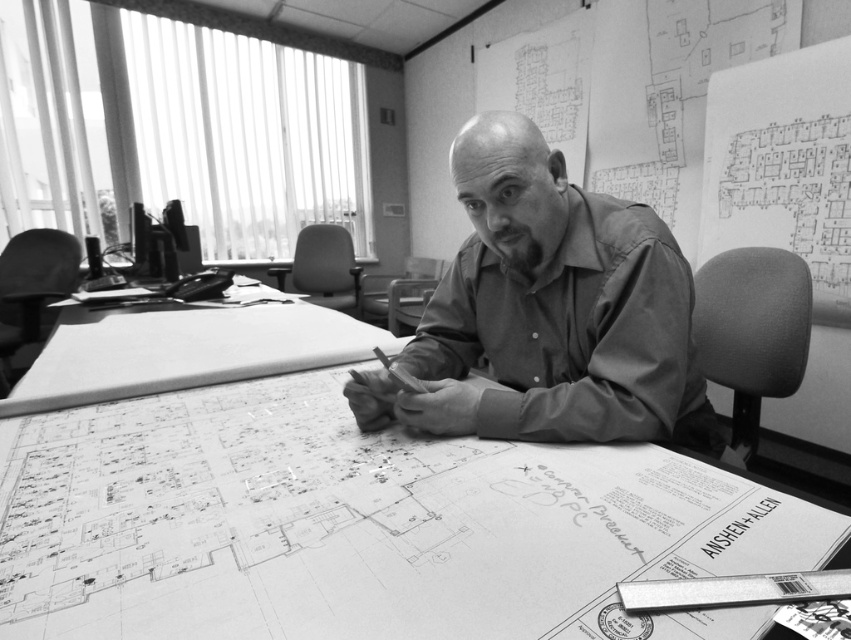
Question: Considering the relative positions of white paper at center and smooth shirt at center in the image provided, where is white paper at center located with respect to smooth shirt at center?

Choices:
 (A) below
 (B) above

Answer: (A)

Question: Can you confirm if white paper at center is thinner than smooth shirt at center?

Choices:
 (A) no
 (B) yes

Answer: (A)

Question: Which of the following is the farthest from the observer?

Choices:
 (A) white paper at center
 (B) smooth shirt at center

Answer: (B)

Question: From the image, what is the correct spatial relationship of white paper at center in relation to smooth shirt at center?

Choices:
 (A) right
 (B) left

Answer: (B)